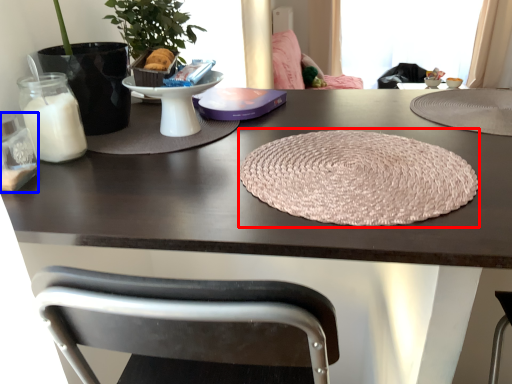
Question: Among these objects, which one is nearest to the camera, yoga mat (highlighted by a red box) or candle holder (highlighted by a blue box)?

Choices:
 (A) yoga mat
 (B) candle holder

Answer: (A)